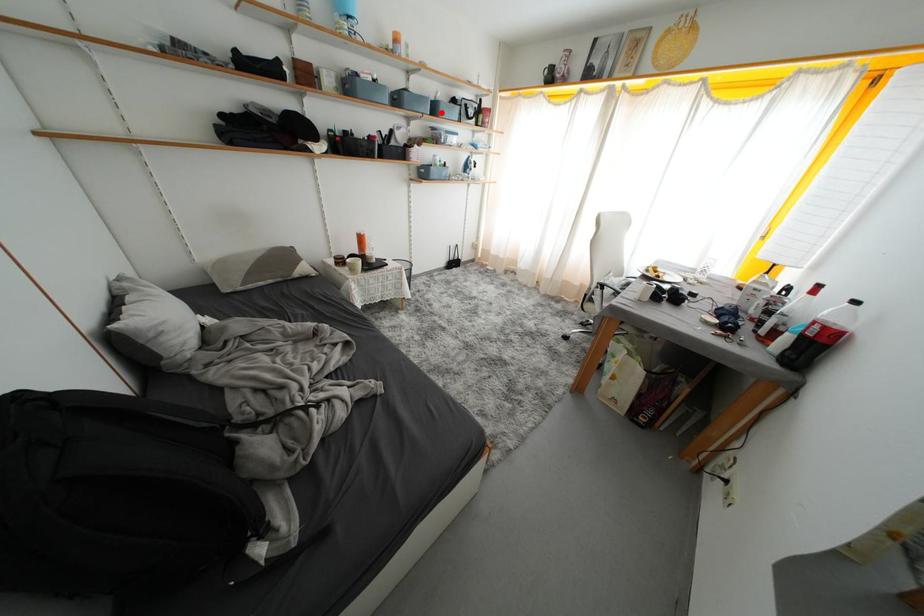
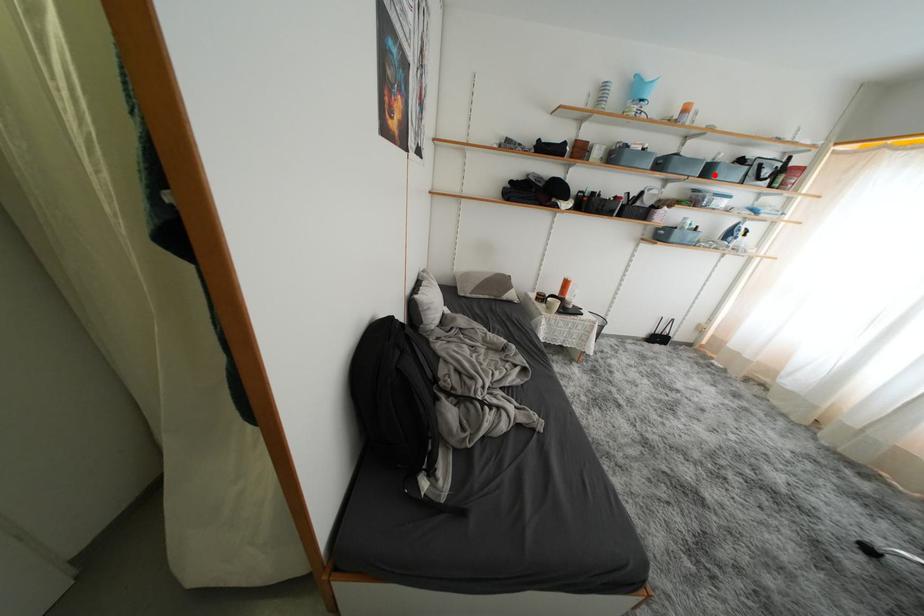
I am providing you with two images of the same scene from different viewpoints. A red point is marked on the first image and another point is marked on the second image. Is the marked point in image1 the same physical position as the marked point in image2?

Yes